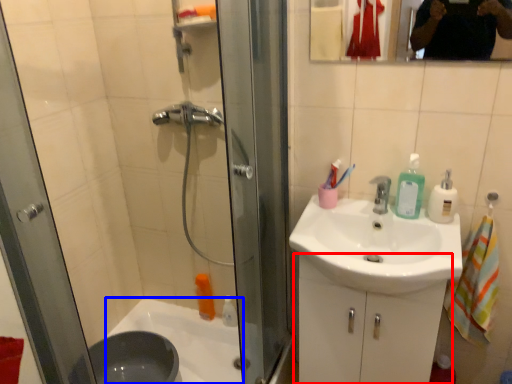
Question: Which point is closer to the camera, bathroom cabinet (highlighted by a red box) or bath (highlighted by a blue box)?

Choices:
 (A) bathroom cabinet
 (B) bath

Answer: (A)